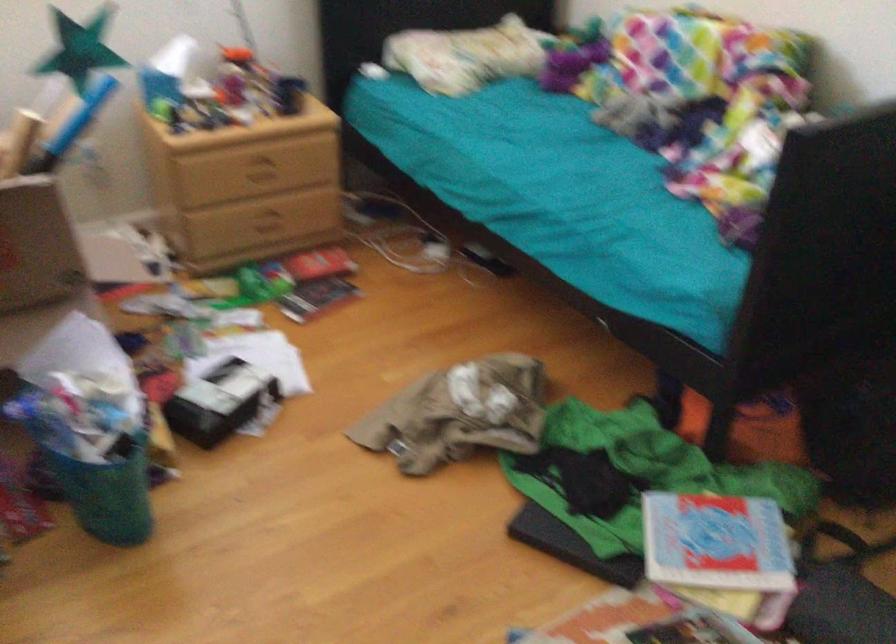
How did the camera likely rotate?

The camera rotated toward left-down.